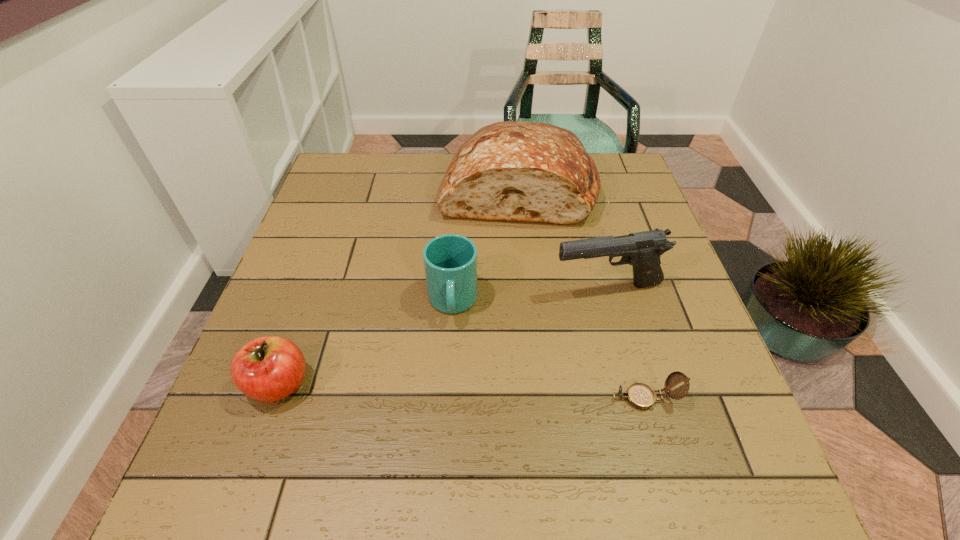
Where is `free location located on the face of the compass`? free location located on the face of the compass is located at coordinates (424, 398).

At what (x,y) coordinates should I click in order to perform the action: click on vacant space located at the muzzle of the second tallest object. Please return your answer as a coordinate pair (x, y). The width and height of the screenshot is (960, 540). Looking at the image, I should click on (527, 339).

Locate an element on the screen. free spot located at the muzzle of the second tallest object is located at coordinates (483, 380).

I want to click on vacant region located at the muzzle of the second tallest object, so click(520, 345).

What are the coordinates of `free space located at the sliced front of the bread` in the screenshot? It's located at (476, 358).

You are a GUI agent. You are given a task and a screenshot of the screen. Output one action in this format:
    pyautogui.click(x=<x>, y=<y>)
    Task: Click on the free space located 0.320m at the sliced front of the bread
    This screenshot has width=960, height=540.
    Given the screenshot: What is the action you would take?
    pyautogui.click(x=483, y=329)

Locate an element on the screen. free region located 0.300m at the sliced front of the bread is located at coordinates (485, 322).

At what (x,y) coordinates should I click in order to perform the action: click on vacant space located on the handle side of the cup. Please return your answer as a coordinate pair (x, y). This screenshot has height=540, width=960. Looking at the image, I should click on (451, 362).

Find the location of a particular element. The height and width of the screenshot is (540, 960). vacant space situated 0.120m on the handle side of the cup is located at coordinates (451, 380).

Locate an element on the screen. This screenshot has width=960, height=540. object that is at the far edge is located at coordinates [x=520, y=171].